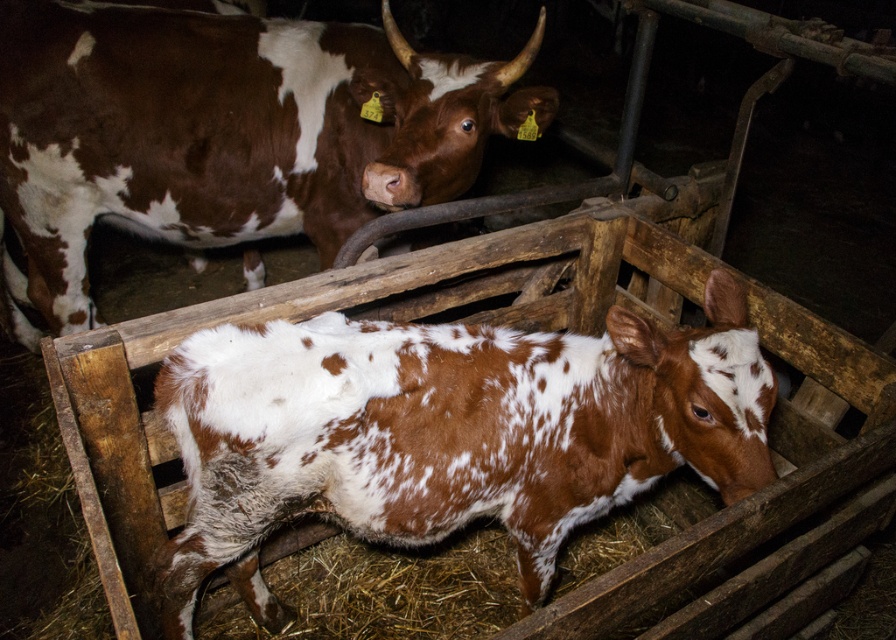
Which is above, brown speckled fur at center or brown speckled hide at center?

brown speckled hide at center is above.

Is the position of brown speckled fur at center more distant than that of brown speckled hide at center?

That is False.

Who is more distant from viewer, (x=467, y=458) or (x=436, y=65)?

Point (x=436, y=65)

Where is `brown speckled fur at center`? The image size is (896, 640). brown speckled fur at center is located at coordinates (446, 433).